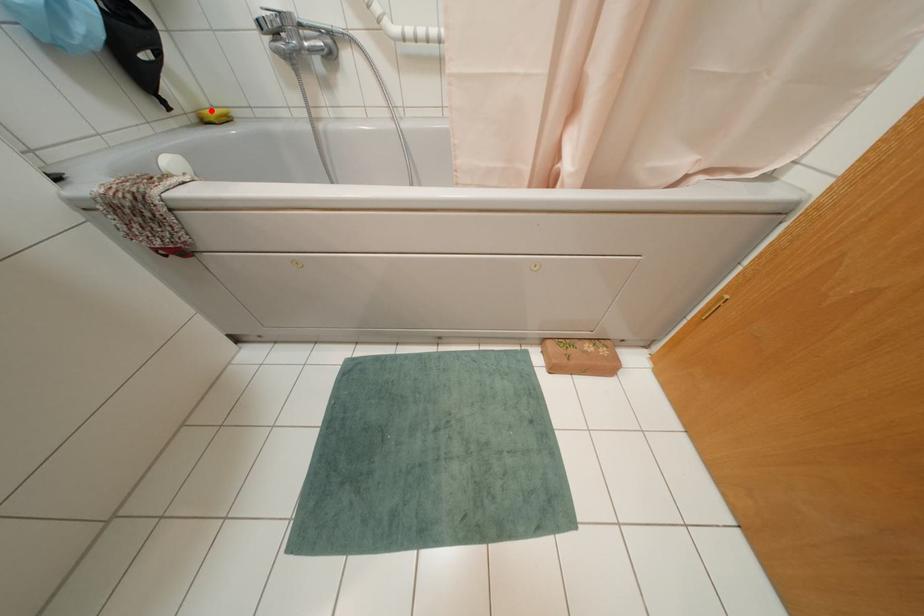
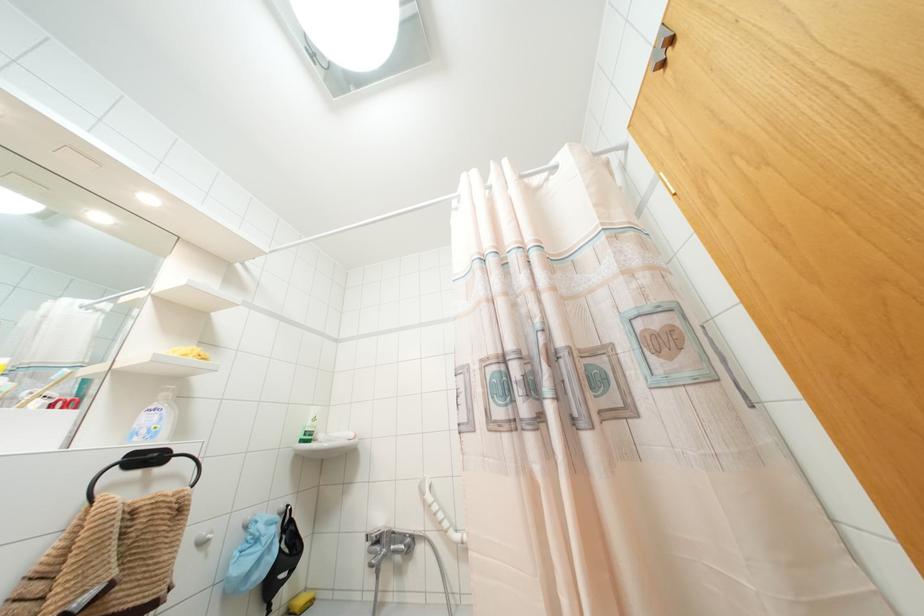
The point at the highlighted location is marked in the first image. Where is the corresponding point in the second image?

(299, 601)